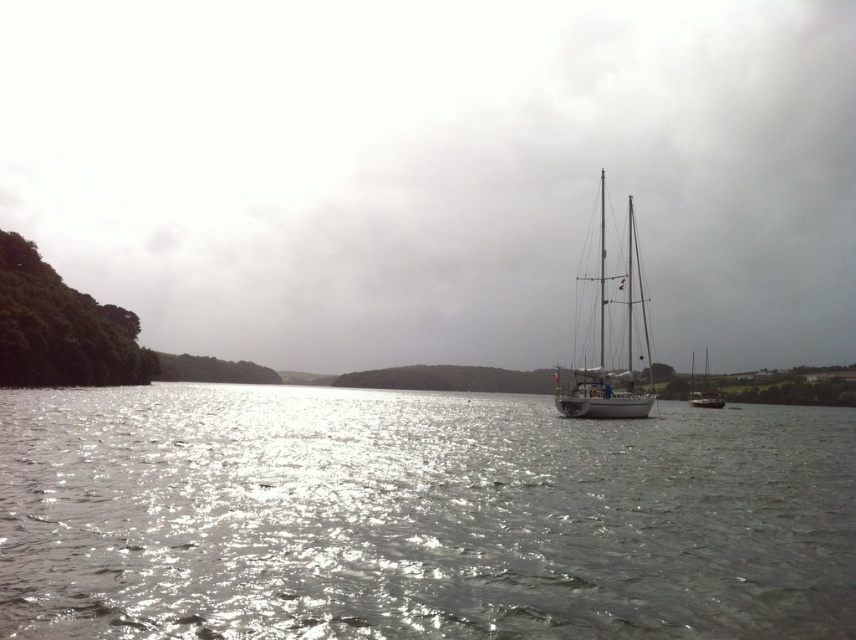
You are a photographer trying to capture both the white glossy sailboat at center and the white matte sailboat at right in a single shot. Based on their positions, which boat will appear closer to the top of your camera frame?

The white glossy sailboat at center will appear closer to the top of the camera frame because it is located above the white matte sailboat at right.

You are navigating a small drone that needs to land on the glistening silver water at center. Based on the coordinates provided in the Objects Description, what are the exact coordinates where the drone should aim to land?

The glistening silver water at center is located at point (417, 516), so the drone should aim for those coordinates to land safely on the glistening silver water at center.

You are a photographer planning to capture a reflection shot of the white glossy sailboat at center and the glistening silver water at center. Since reflections require the water to be still, which object should you focus on to ensure the reflection is clear?

The glistening silver water at center is to the left of white glossy sailboat at center, so focusing on the glistening silver water at center will ensure the reflection is clear as it is the water surface where the reflection would form.